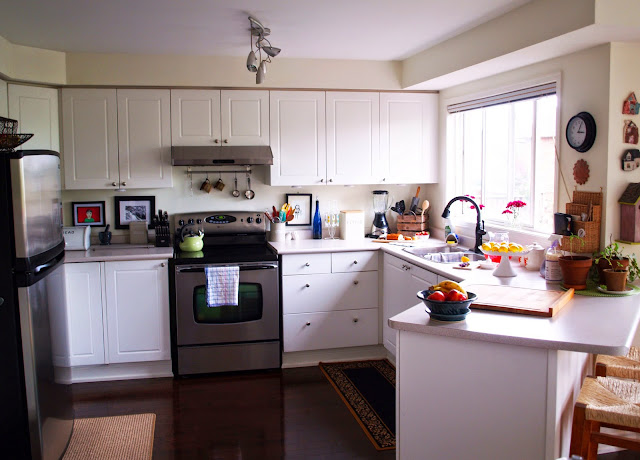
What are the coordinates of `light brown mat` in the screenshot? It's located at (108, 439).